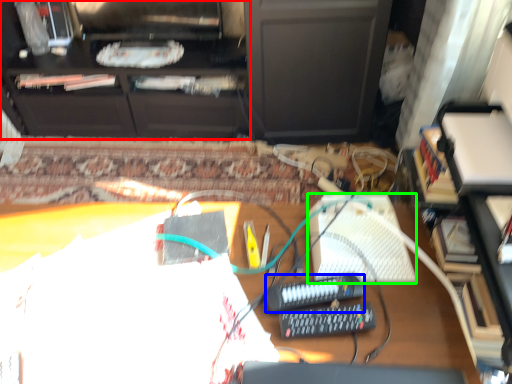
Question: Which object is positioned closest to furniture (highlighted by a red box)? Select from equipment (highlighted by a blue box) and keyboard (highlighted by a green box).

Choices:
 (A) equipment
 (B) keyboard

Answer: (B)